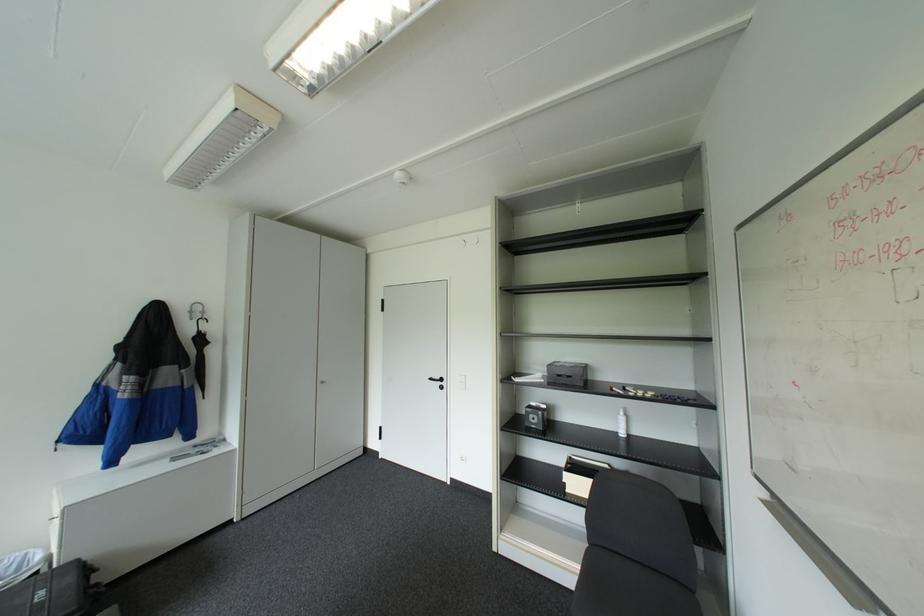
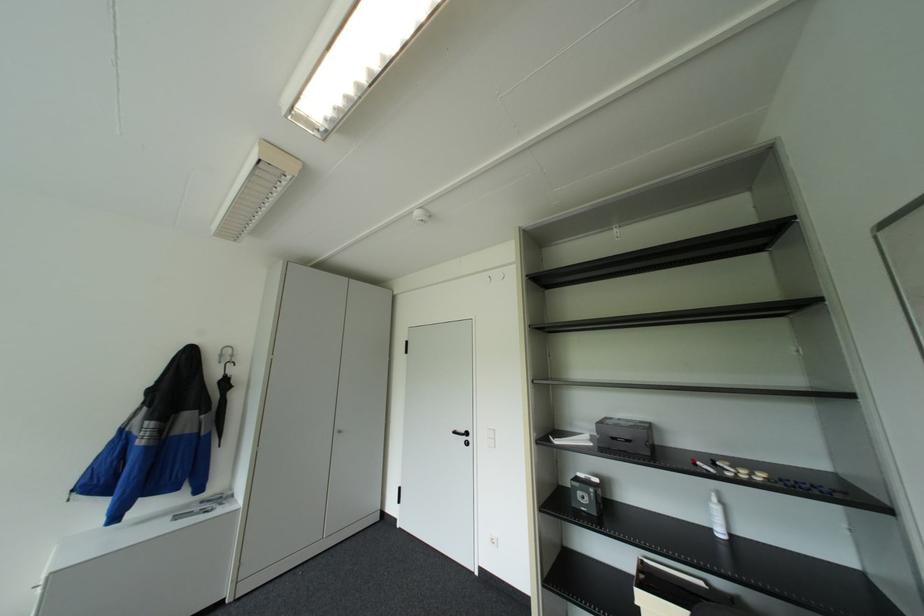
Locate, in the second image, the point that corresponds to (x=201, y=386) in the first image.

(217, 432)